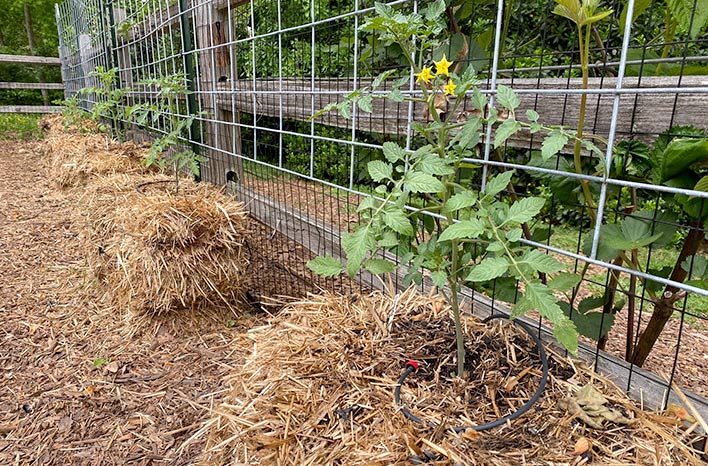
Where is `cable`? This screenshot has width=708, height=466. cable is located at coordinates (501, 420).